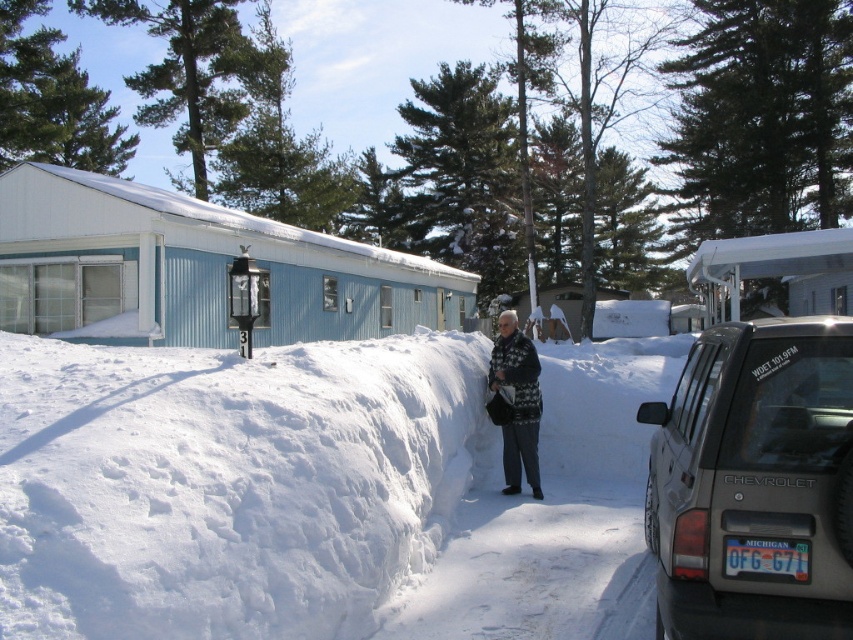
Consider the image. What are the coordinates of the white fluffy snow at center in the image?

The white fluffy snow at center is located at coordinates point (225, 483).

Based on the coordinates provided, what is located at point (225, 483) in the snowy scene?

The point (225, 483) corresponds to white fluffy snow at center.

Looking at this image, you are a photographer trying to capture the white fluffy snow at center and the white knitted sweater at center in a single shot. Which object will appear larger in the photo if you focus on the snow?

The white fluffy snow at center will appear larger in the photo because it is closer to the viewer than the white knitted sweater at center.